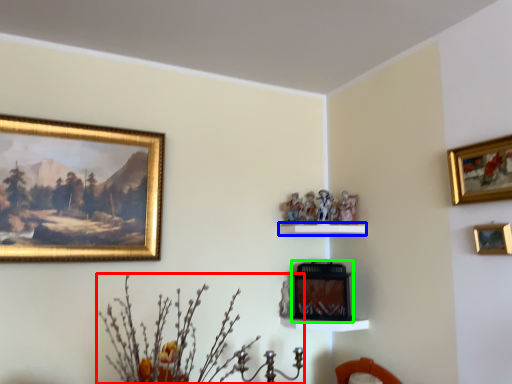
Question: Considering the real-world distances, which object is farthest from floral arrangement (highlighted by a red box)? shelf (highlighted by a blue box) or picture frame (highlighted by a green box)?

Choices:
 (A) shelf
 (B) picture frame

Answer: (A)